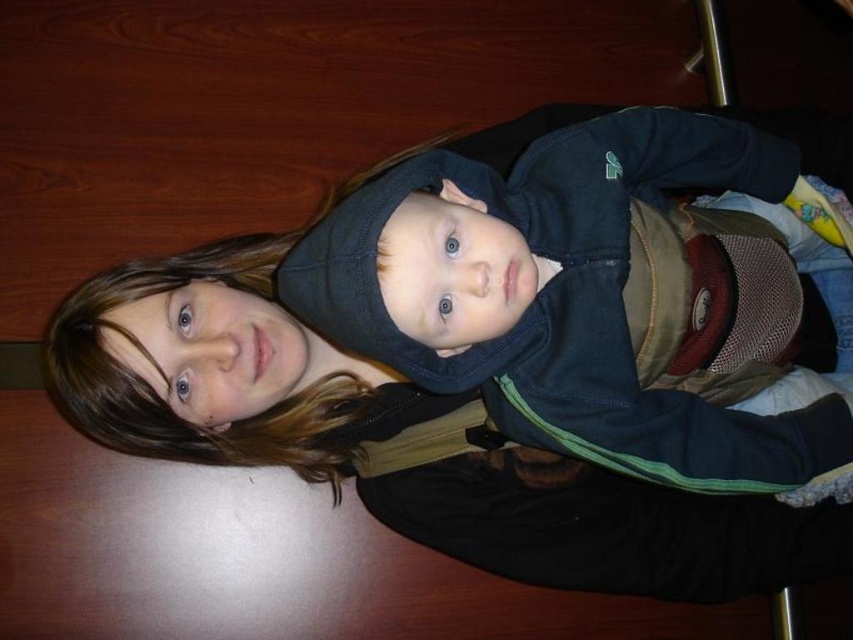
You are a photographer setting up a photo shoot in a room with a wooden surface. You have two items to place on the surface for the shoot. The matte black jacket at center and the dark blue fleece at center. According to the scene, which item should be placed to the left to match the original image?

The matte black jacket at center should be placed to the left of the dark blue fleece at center to match the original image.

You are a photographer setting up a shoot in this scene. You need to place a small prop between the matte black jacket at center and the dark blue fleece at center. Which jacket should you place the prop closer to if you want the prop to be visually balanced between them?

The matte black jacket at center is larger than the dark blue fleece at center. To achieve visual balance, the prop should be placed closer to the dark blue fleece at center since it is smaller, counterbalancing the larger jacket.

Based on the photo, you are standing in the room shown in the image and want to locate the matte black jacket at center. According to the coordinates provided, where would you find it?

The matte black jacket at center is located at point [395,440].